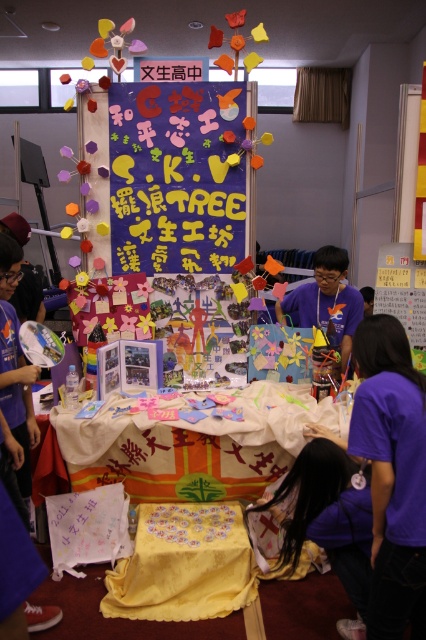
Question: Does yellow fabric-covered table at center have a lesser width compared to purple fabric at lower right?

Choices:
 (A) yes
 (B) no

Answer: (B)

Question: Which of the following is the farthest from the observer?

Choices:
 (A) purple paperboard at center
 (B) purple fabric at lower right

Answer: (A)

Question: Which point is farther to the camera?

Choices:
 (A) (351, 572)
 (B) (135, 612)

Answer: (B)

Question: Is yellow fabric table at center bigger than purple fabric at center?

Choices:
 (A) no
 (B) yes

Answer: (B)

Question: Is purple paperboard at center further to camera compared to yellow fabric table at center?

Choices:
 (A) yes
 (B) no

Answer: (A)

Question: Which of the following is the farthest from the observer?

Choices:
 (A) (178, 605)
 (B) (193, 168)

Answer: (B)